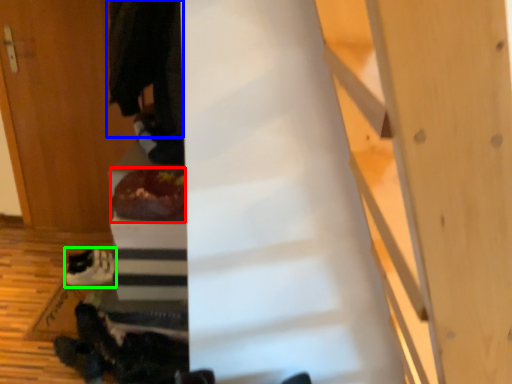
Question: Which object is the farthest from food (highlighted by a red box)? Choose among these: robe (highlighted by a blue box) or footwear (highlighted by a green box).

Choices:
 (A) robe
 (B) footwear

Answer: (B)